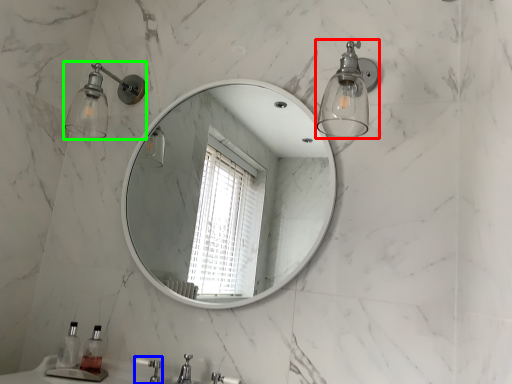
Question: Based on their relative distances, which object is nearer to light fixture (highlighted by a red box)? Choose from faucet (highlighted by a blue box) and shower (highlighted by a green box).

Choices:
 (A) faucet
 (B) shower

Answer: (B)